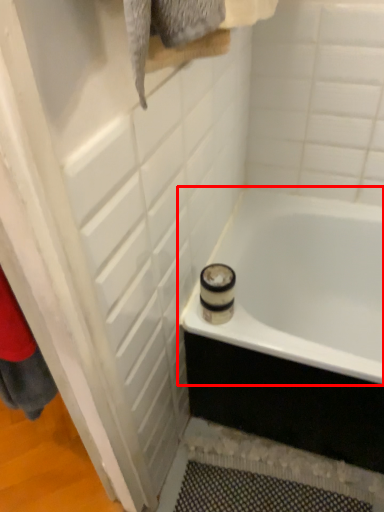
Question: Where is bathtub (annotated by the red box) located in relation to screen door in the image?

Choices:
 (A) right
 (B) left

Answer: (A)